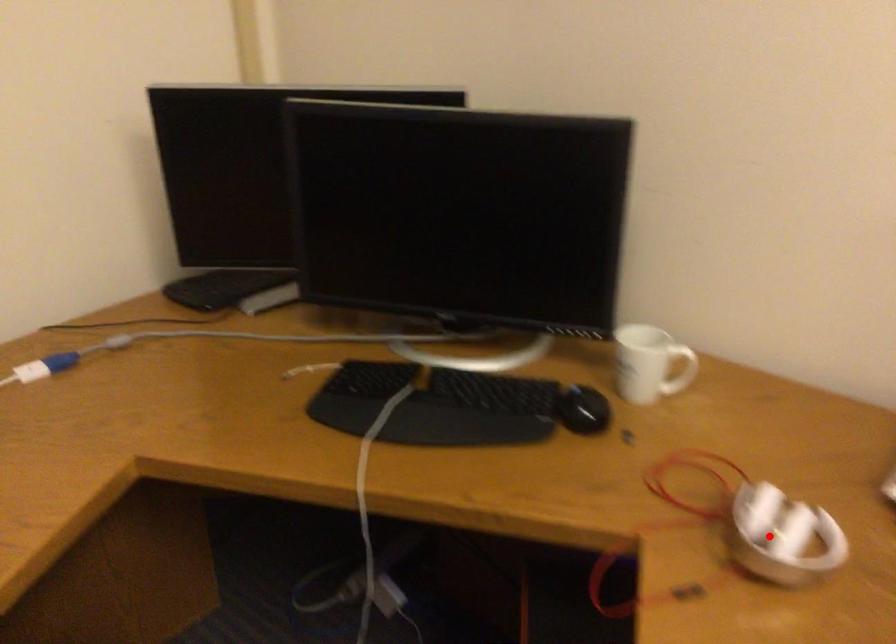
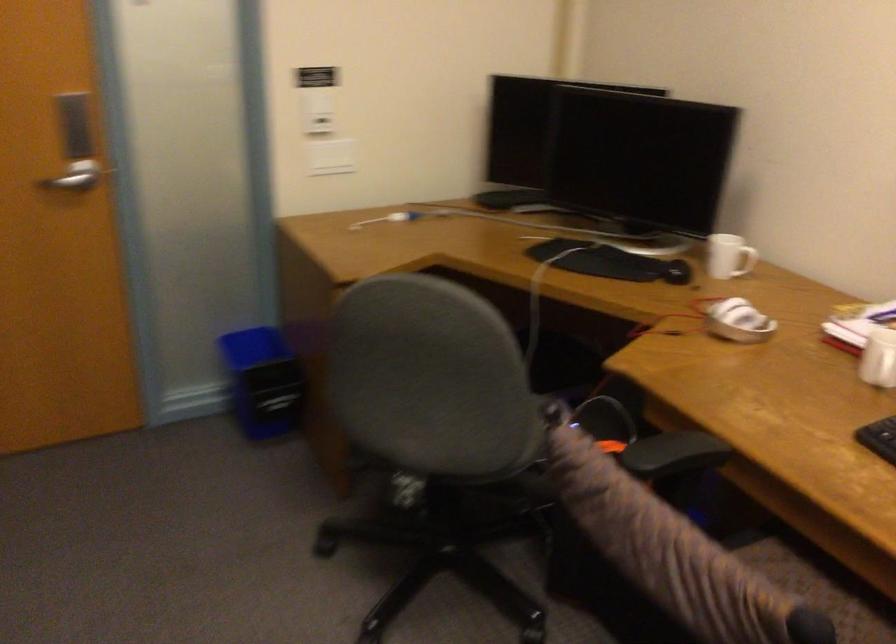
In the second image, find the point that corresponds to the highlighted location in the first image.

(737, 321)